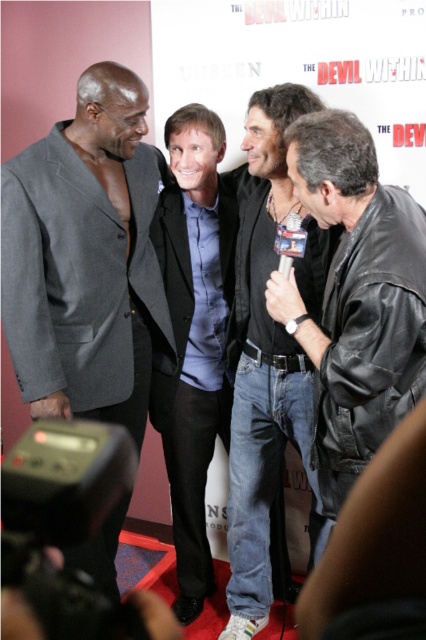
Is black leather jacket at right thinner than matte black suit at center?

No.

Which is more to the left, black leather jacket at right or matte black suit at center?

matte black suit at center is more to the left.

Locate an element on the screen. This screenshot has width=426, height=640. black leather jacket at right is located at coordinates (356, 296).

Can you confirm if gray wool suit at left is positioned to the left of black leather jacket at right?

Indeed, gray wool suit at left is positioned on the left side of black leather jacket at right.

Which of these two, gray wool suit at left or black leather jacket at right, stands shorter?

With less height is black leather jacket at right.

Between point (135, 109) and point (362, 332), which one is positioned behind?

The point (135, 109) is more distant.

Locate an element on the screen. The height and width of the screenshot is (640, 426). gray wool suit at left is located at coordinates (86, 259).

Which is in front, point (294, 88) or point (224, 150)?

Positioned in front is point (294, 88).

Does jeans at center come behind matte black suit at center?

That is False.

Describe the element at coordinates (267, 358) in the screenshot. I see `jeans at center` at that location.

Identify the location of jeans at center. 267,358.